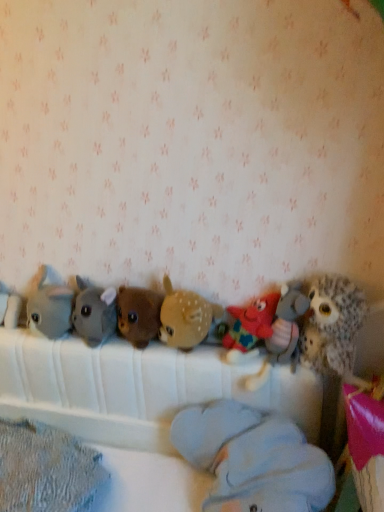
Question: Is fuzzy brown owl at right, which is the ninth toy in left-to-right order, positioned in front of soft gray plush at center, the third toy in the left-to-right sequence?

Choices:
 (A) yes
 (B) no

Answer: (A)

Question: Can you confirm if fuzzy brown owl at right, which is counted as the 1th toy, starting from the right, is bigger than soft gray plush at center, marked as the 7th toy in a right-to-left arrangement?

Choices:
 (A) no
 (B) yes

Answer: (B)

Question: Does fuzzy brown owl at right, which is counted as the 1th toy, starting from the right, have a greater height compared to soft gray plush at center, the third toy in the left-to-right sequence?

Choices:
 (A) no
 (B) yes

Answer: (B)

Question: Considering the relative positions of fuzzy brown owl at right, which is counted as the 1th toy, starting from the right, and soft gray plush at center, the third toy in the left-to-right sequence, in the image provided, is fuzzy brown owl at right, which is counted as the 1th toy, starting from the right, to the left of soft gray plush at center, the third toy in the left-to-right sequence, from the viewer's perspective?

Choices:
 (A) no
 (B) yes

Answer: (A)

Question: Is the surface of fuzzy brown owl at right, which is counted as the 1th toy, starting from the right, in direct contact with soft gray plush at center, the third toy in the left-to-right sequence?

Choices:
 (A) no
 (B) yes

Answer: (A)

Question: Based on their positions, is light blue plush at center, positioned as the fourth toy in right-to-left order, located to the left or right of soft gray plush at center, marked as the 7th toy in a right-to-left arrangement?

Choices:
 (A) right
 (B) left

Answer: (A)

Question: From the image's perspective, relative to soft gray plush at center, the third toy in the left-to-right sequence, is light blue plush at center, marked as the 6th toy in a left-to-right arrangement, above or below?

Choices:
 (A) above
 (B) below

Answer: (B)

Question: Considering their positions, is light blue plush at center, positioned as the fourth toy in right-to-left order, located in front of or behind soft gray plush at center, the third toy in the left-to-right sequence?

Choices:
 (A) behind
 (B) front

Answer: (B)

Question: Considering the positions of light blue plush at center, marked as the 6th toy in a left-to-right arrangement, and soft gray plush at center, the third toy in the left-to-right sequence, in the image, is light blue plush at center, marked as the 6th toy in a left-to-right arrangement, wider or thinner than soft gray plush at center, the third toy in the left-to-right sequence,?

Choices:
 (A) thin
 (B) wide

Answer: (B)

Question: Choose the correct answer: Is brown fuzzy deer at center, marked as the fifth toy in a left-to-right arrangement, inside fuzzy brown owl at right, which is counted as the 1th toy, starting from the right, or outside it?

Choices:
 (A) outside
 (B) inside

Answer: (A)

Question: From their relative heights in the image, would you say brown fuzzy deer at center, positioned as the fifth toy in right-to-left order, is taller or shorter than fuzzy brown owl at right, which is counted as the 1th toy, starting from the right?

Choices:
 (A) short
 (B) tall

Answer: (A)

Question: Based on their sizes in the image, would you say brown fuzzy deer at center, marked as the fifth toy in a left-to-right arrangement, is bigger or smaller than fuzzy brown owl at right, which is counted as the 1th toy, starting from the right?

Choices:
 (A) small
 (B) big

Answer: (A)

Question: From the image's perspective, relative to fuzzy brown owl at right, which is the ninth toy in left-to-right order, is brown fuzzy deer at center, marked as the fifth toy in a left-to-right arrangement, above or below?

Choices:
 (A) below
 (B) above

Answer: (B)

Question: Looking at the image, does brown plush bear at center, which appears as the 4th toy when viewed from the left, seem bigger or smaller compared to light blue plush at center, positioned as the fourth toy in right-to-left order?

Choices:
 (A) big
 (B) small

Answer: (B)

Question: Considering the relative positions of brown plush bear at center, which appears as the 4th toy when viewed from the left, and light blue plush at center, positioned as the fourth toy in right-to-left order, in the image provided, is brown plush bear at center, which appears as the 4th toy when viewed from the left, to the left or to the right of light blue plush at center, positioned as the fourth toy in right-to-left order,?

Choices:
 (A) right
 (B) left

Answer: (B)